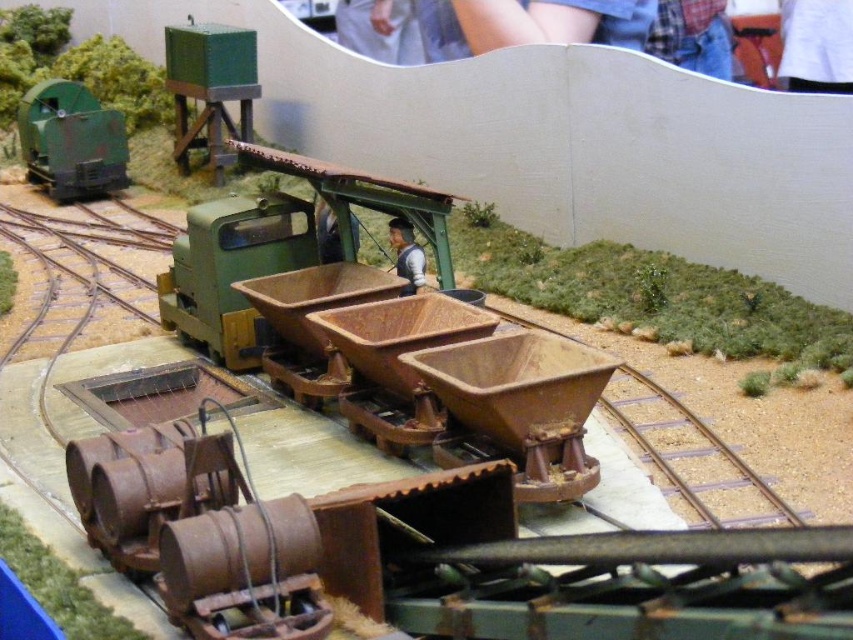
You are a model railway enthusiast examining the layout. You notice the rusty metal train track at center and the matte green train at left. From your vantage point, which object is closer to you?

The rusty metal train track at center is closer to you because it is positioned in front of the matte green train at left.

From the picture: You are a model railway enthusiast inspecting the layout. You notice the rusty metal train track at center and the matte green train at left. Which object appears larger in the scene?

The matte green train at left appears larger than the rusty metal train track at center.

You are a model railway enthusiast who wants to place a new toy car that is 10 feet long between the rusty metal train track at center and the matte green train at left. Is there enough space between them to fit the toy car without overlapping either object?

The distance between the rusty metal train track at center and the matte green train at left is 35.86 feet. Since the toy car is only 10 feet long, there is sufficient space to place it between them without overlapping either object.